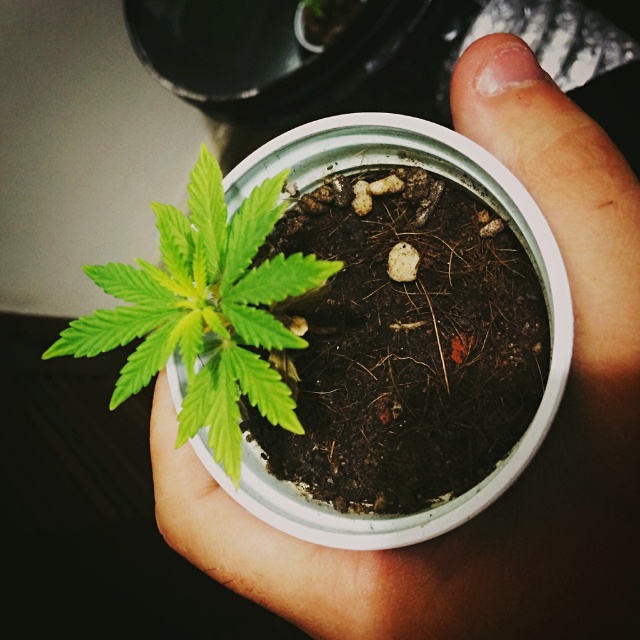
Can you confirm if smooth skin hand at center is smaller than green matte leafy plant at center?

Incorrect, smooth skin hand at center is not smaller in size than green matte leafy plant at center.

Who is shorter, smooth skin hand at center or green matte leafy plant at center?

green matte leafy plant at center is shorter.

Find the location of `smooth skin hand at center`. smooth skin hand at center is located at coordinates (525, 467).

Identify the location of smooth skin hand at center. Image resolution: width=640 pixels, height=640 pixels. (x=525, y=467).